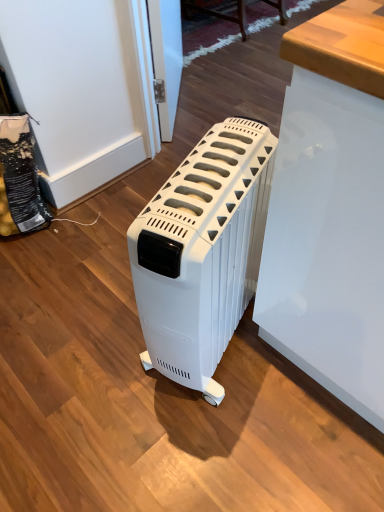
The width and height of the screenshot is (384, 512). What do you see at coordinates (202, 252) in the screenshot?
I see `white plastic radiator at center` at bounding box center [202, 252].

Locate an element on the screen. white plastic radiator at center is located at coordinates (202, 252).

The image size is (384, 512). I want to click on white plastic radiator at center, so click(x=202, y=252).